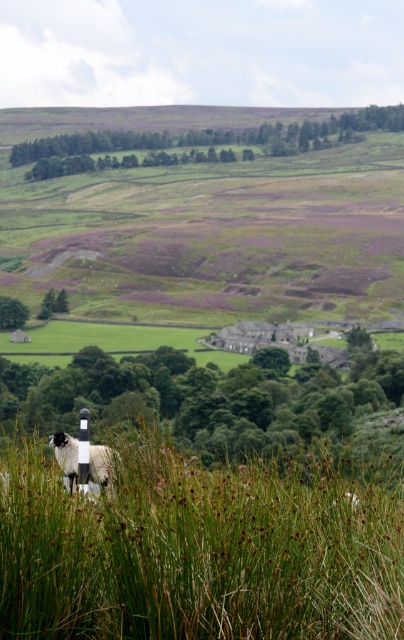
You are a photographer aiming to capture a closeup of the green grassy at lower left and the black and white woolen sheep at lower left in the same frame. Based on their heights, which one will appear larger in the photo?

The green grassy at lower left will appear larger in the photo because it has a greater height compared to the black and white woolen sheep at lower left.

You are standing at the center of the scene and see the green grassy at lower left and the black and white woolen sheep at lower left. Which object is positioned to the right side from your perspective?

The green grassy at lower left is positioned to the right of the black and white woolen sheep at lower left.